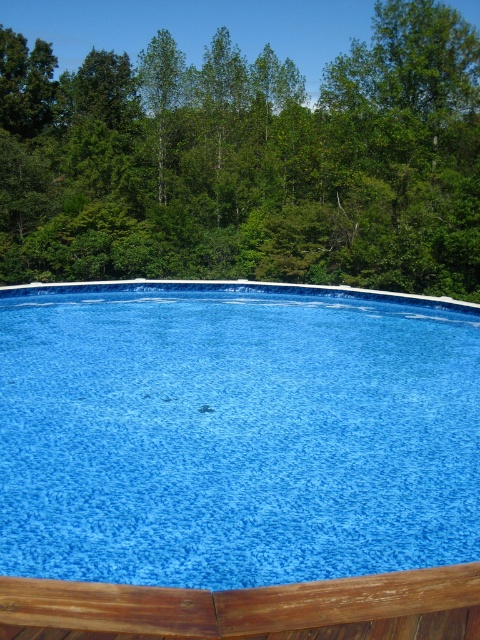
Question: In this image, where is blue textured pool at center located relative to wooden deck at bottom?

Choices:
 (A) above
 (B) below

Answer: (A)

Question: Can you confirm if blue textured pool at center is positioned to the left of wooden deck at bottom?

Choices:
 (A) no
 (B) yes

Answer: (B)

Question: Based on their relative distances, which object is nearer to the green leafy tree at upper center?

Choices:
 (A) blue textured pool at center
 (B) wooden deck at bottom

Answer: (A)

Question: Can you confirm if green leafy tree at upper center is positioned to the left of wooden deck at bottom?

Choices:
 (A) yes
 (B) no

Answer: (A)

Question: Which of these objects is positioned farthest from the green leafy tree at upper center?

Choices:
 (A) blue textured pool at center
 (B) wooden deck at bottom

Answer: (B)

Question: Based on their relative distances, which object is farther from the green leafy tree at upper center?

Choices:
 (A) wooden deck at bottom
 (B) blue textured pool at center

Answer: (A)